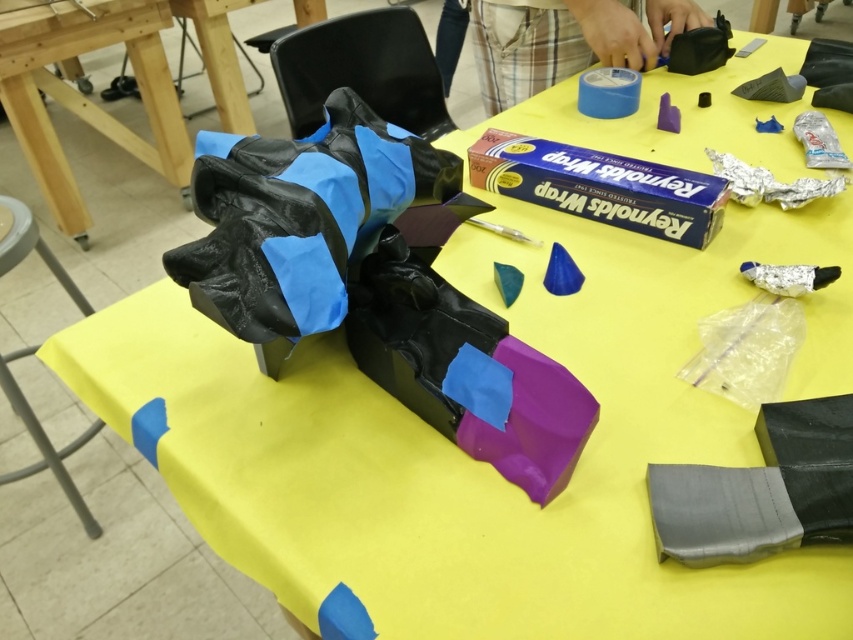
You are an assistant helping with assembling the robotic arm. You need to place the matte black glove at center and the blue matte tape at upper center on the workspace. Considering their sizes, which object requires more horizontal space?

The blue matte tape at upper center requires more horizontal space because it has a greater width than the matte black glove at center.

You are an engineer working on assembling a robotic arm. You have a matte black glove at center and a yellow matte table at center in your workspace. Which object takes up more horizontal space?

The yellow matte table at center has a greater width than the matte black glove at center, so it takes up more horizontal space.

You are standing at the workspace with the yellow tablecloth. You need to place a small tool between the two points marked on the table. The first point is at coordinates point (419,140) and the second is at point (57,202). Which point should you move towards to position the tool closer to the front of the workspace?

Point (419,140) is in front of point (57,202). Therefore, to place the tool closer to the front of the workspace, you should move towards point (419,140).